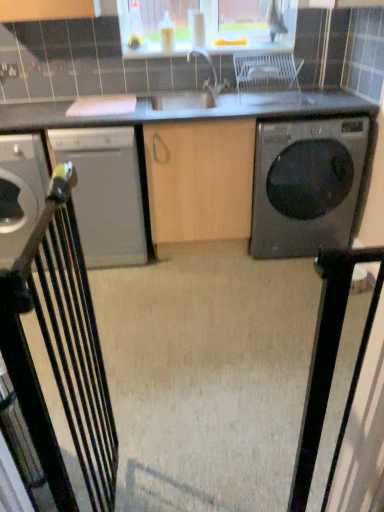
Question: Should I look upward or downward to see black glossy washing machine at right?

Choices:
 (A) down
 (B) up

Answer: (B)

Question: From a real-world perspective, is satin white dishwasher at left, marked as the first home appliance in a right-to-left arrangement, physically below white plastic chair at center, the 2th chair when ordered from left to right?

Choices:
 (A) no
 (B) yes

Answer: (B)

Question: Does satin white dishwasher at left, placed as the 2th home appliance when sorted from left to right, come behind white plastic chair at center, positioned as the second chair in front-to-back order?

Choices:
 (A) no
 (B) yes

Answer: (B)

Question: From a real-world perspective, is satin white dishwasher at left, marked as the first home appliance in a right-to-left arrangement, positioned over white plastic chair at center, the first chair positioned from the right, based on gravity?

Choices:
 (A) no
 (B) yes

Answer: (A)

Question: Is white plastic chair at center, which appears as the 2th chair when ordered from the bottom, a part of satin white dishwasher at left, marked as the first home appliance in a right-to-left arrangement?

Choices:
 (A) yes
 (B) no

Answer: (B)

Question: Is satin white dishwasher at left, marked as the first home appliance in a right-to-left arrangement, shorter than white plastic chair at center, the 1th chair viewed from the back?

Choices:
 (A) no
 (B) yes

Answer: (A)

Question: Is white plastic chair at center, the first chair positioned from the right, at the back of satin white dishwasher at left, placed as the 2th home appliance when sorted from left to right?

Choices:
 (A) no
 (B) yes

Answer: (A)

Question: Can you confirm if white plastic chair at center, the 1th chair viewed from the back, is taller than metallic gray dishwasher at left, which is the 2th home appliance from right to left?

Choices:
 (A) no
 (B) yes

Answer: (A)

Question: Is white plastic chair at center, positioned as the second chair in front-to-back order, further to camera compared to metallic gray dishwasher at left, which is the 2th home appliance from right to left?

Choices:
 (A) no
 (B) yes

Answer: (A)

Question: Can you confirm if white plastic chair at center, the first chair positioned from the right, is wider than metallic gray dishwasher at left, which is the 2th home appliance from right to left?

Choices:
 (A) no
 (B) yes

Answer: (A)

Question: Would you consider white plastic chair at center, the 2th chair when ordered from left to right, to be distant from metallic gray dishwasher at left, which is the 2th home appliance from right to left?

Choices:
 (A) yes
 (B) no

Answer: (A)

Question: From a real-world perspective, is white plastic chair at center, which appears as the 1th chair when viewed from the top, located higher than metallic gray dishwasher at left, which is the 2th home appliance from right to left?

Choices:
 (A) no
 (B) yes

Answer: (B)

Question: From the image's perspective, is white plastic chair at center, which appears as the 2th chair when ordered from the bottom, located above metallic gray dishwasher at left, which is the 1th home appliance from left to right?

Choices:
 (A) yes
 (B) no

Answer: (A)

Question: Considering the relative sizes of satin white dishwasher at left, marked as the first home appliance in a right-to-left arrangement, and black glossy washing machine at right in the image provided, is satin white dishwasher at left, marked as the first home appliance in a right-to-left arrangement, taller than black glossy washing machine at right?

Choices:
 (A) yes
 (B) no

Answer: (A)